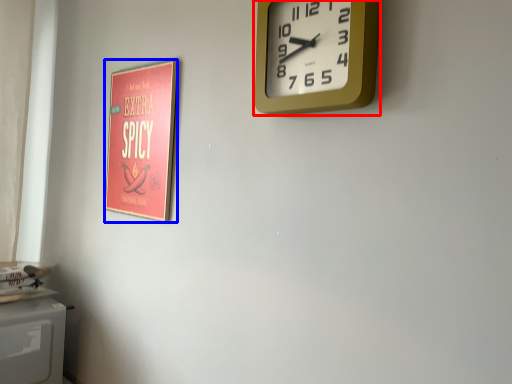
Question: Which point is closer to the camera, wall clock (highlighted by a red box) or poster page (highlighted by a blue box)?

Choices:
 (A) wall clock
 (B) poster page

Answer: (A)